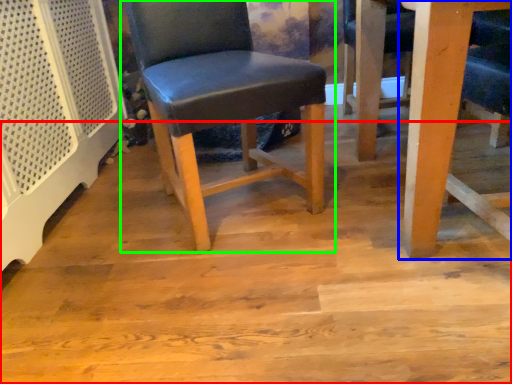
Question: Which object is the farthest from plywood (highlighted by a red box)? Choose among these: table (highlighted by a blue box) or chair (highlighted by a green box).

Choices:
 (A) table
 (B) chair

Answer: (A)